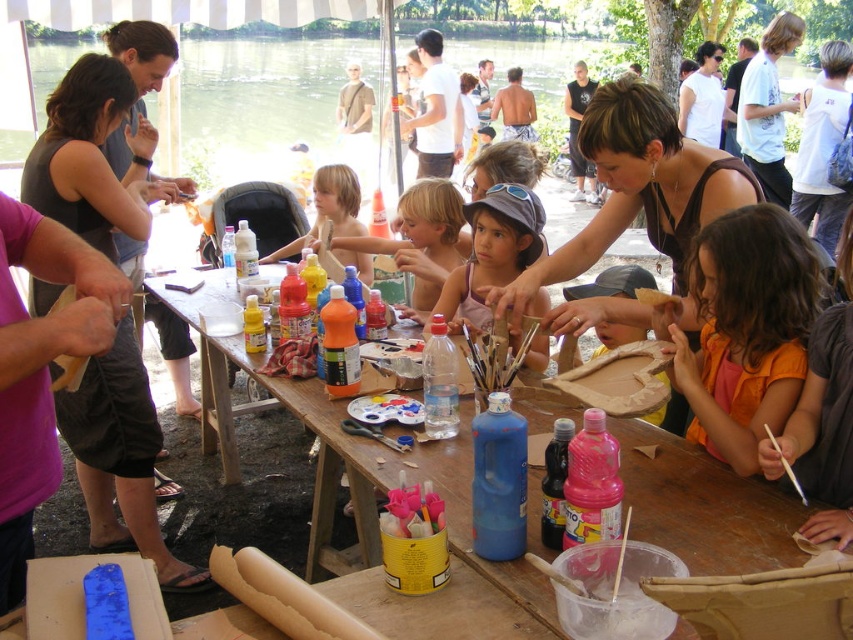
Question: Does pink fabric shirt at center have a smaller size compared to blonde hair at center?

Choices:
 (A) yes
 (B) no

Answer: (A)

Question: Which object is the closest to the blonde hair child at center?

Choices:
 (A) pink fabric shirt at center
 (B) blonde hair at center
 (C) orange fabric shirt at lower right
 (D) yellow paper at center

Answer: (B)

Question: Which of the following is the farthest from the observer?

Choices:
 (A) blonde hair child at center
 (B) wooden table at center
 (C) matte brown tank top at center

Answer: (A)

Question: Can you confirm if wooden table at center is wider than matte brown tank top at center?

Choices:
 (A) yes
 (B) no

Answer: (A)

Question: Based on their relative distances, which object is farther from the pink fabric shirt at center?

Choices:
 (A) orange fabric shirt at lower right
 (B) blonde hair at center
 (C) matte brown tank top at center
 (D) blonde hair child at center

Answer: (D)

Question: Can you confirm if wooden table at center is thinner than pink fabric shirt at center?

Choices:
 (A) yes
 (B) no

Answer: (B)